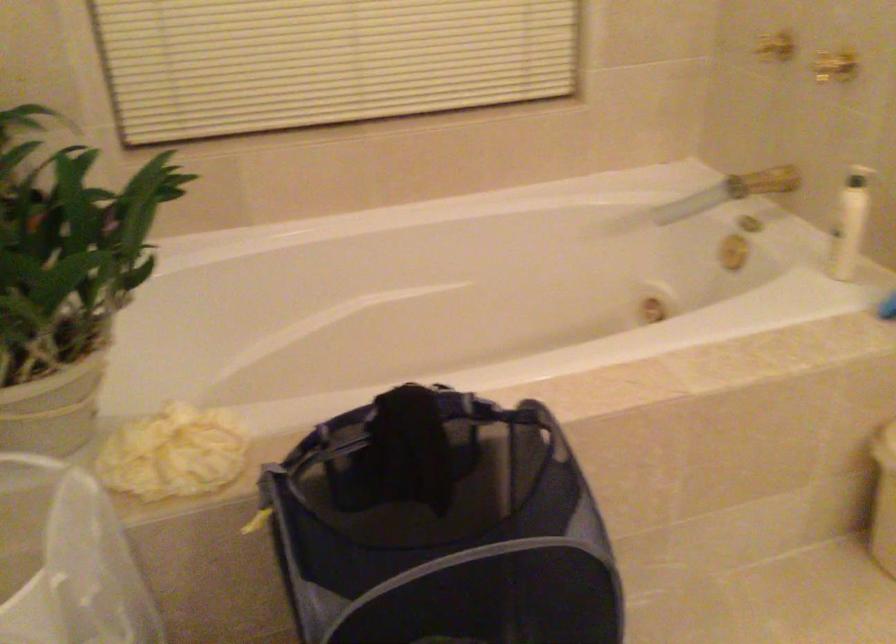
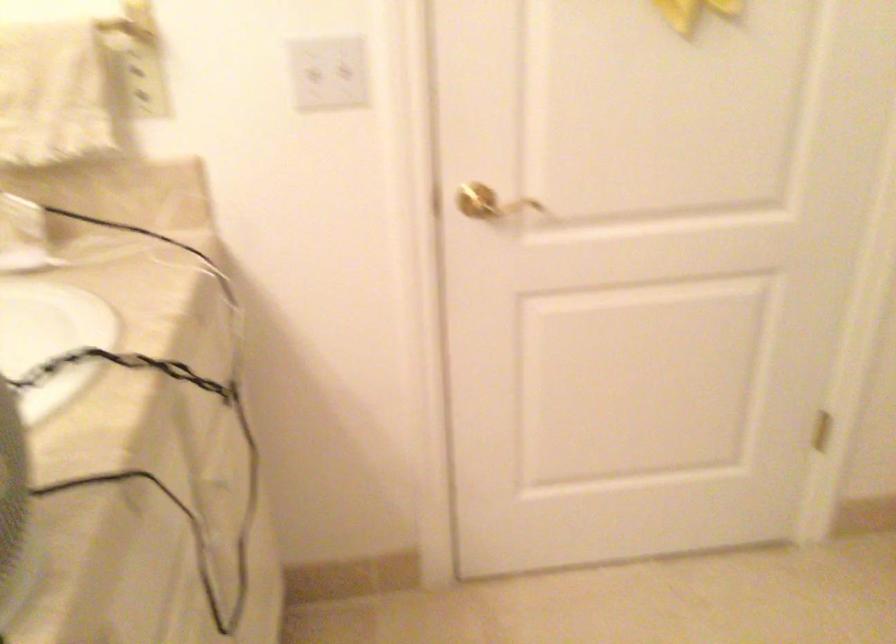
The images are taken continuously from a first-person perspective. In which direction is your viewpoint rotating?

The camera's rotation is toward left-down.